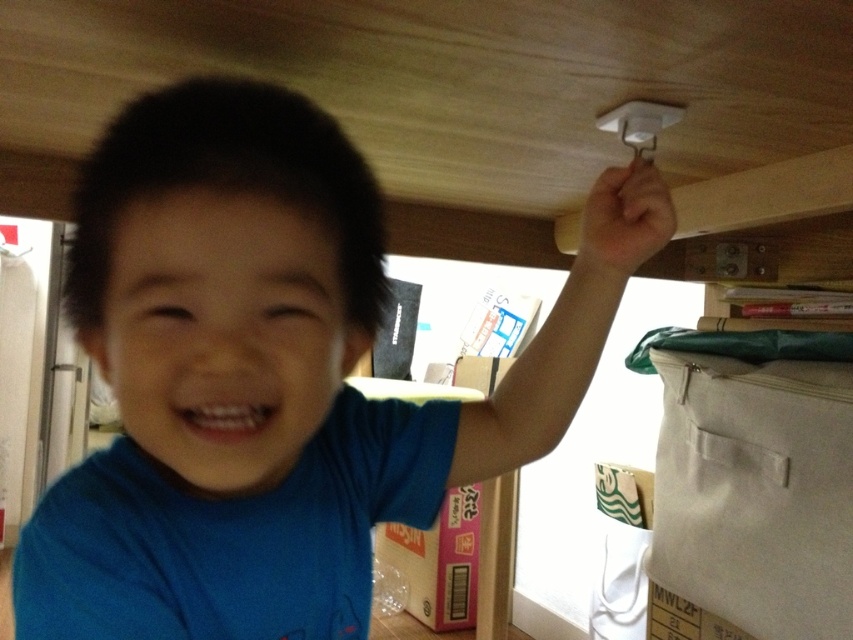
Question: Which point appears closest to the camera in this image?

Choices:
 (A) (129, 506)
 (B) (775, 438)

Answer: (A)

Question: Can you confirm if blue t-shirt at center is wider than canvas bag at right?

Choices:
 (A) no
 (B) yes

Answer: (B)

Question: Can you confirm if blue t-shirt at center is positioned below canvas bag at right?

Choices:
 (A) no
 (B) yes

Answer: (A)

Question: Among these points, which one is farthest from the camera?

Choices:
 (A) (35, 579)
 (B) (695, 387)

Answer: (B)

Question: Does blue t-shirt at center come behind canvas bag at right?

Choices:
 (A) yes
 (B) no

Answer: (B)

Question: Which point is closer to the camera?

Choices:
 (A) blue t-shirt at center
 (B) canvas bag at right

Answer: (A)